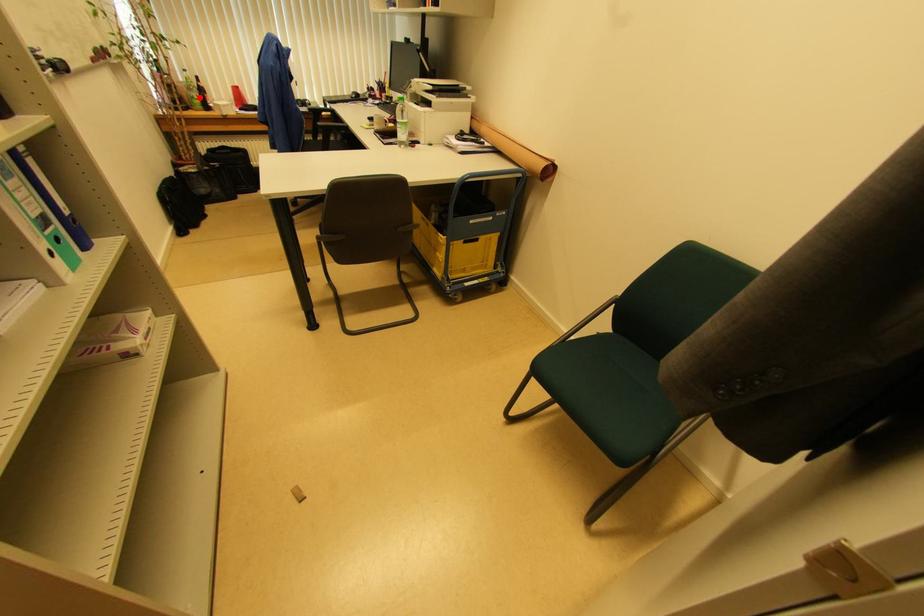
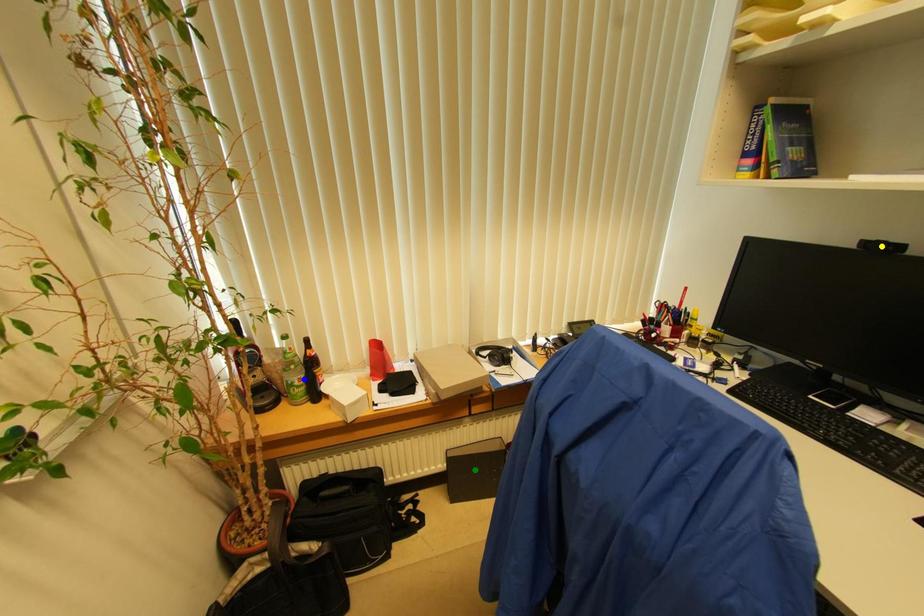
Question: I am providing you with two images of the same scene from different viewpoints. A red point is marked on the first image. You are given multiple points on the second image. In image 2, which mark is for the same physical point as the one in image 1?

Choices:
 (A) green point
 (B) blue point
 (C) yellow point

Answer: (B)